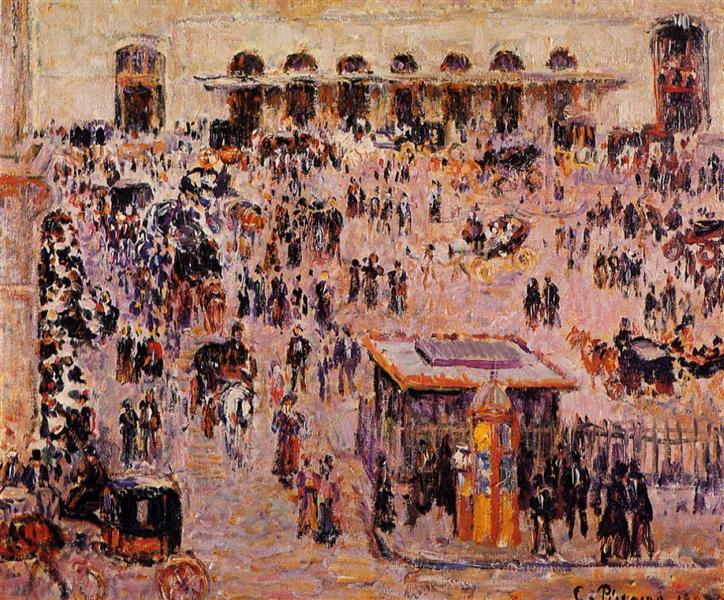
Identify the location of large entryway into building. (140, 104).